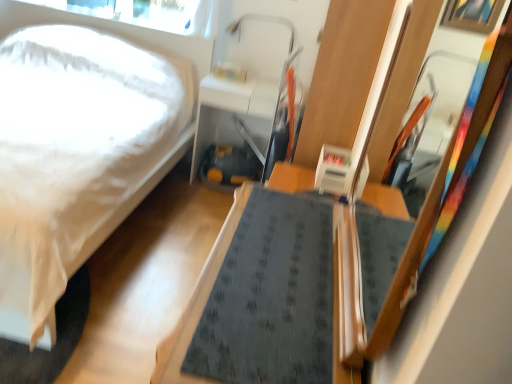
In order to face matte white table at center, the second table from the front, should I rotate leftwards or rightwards?

Turn left by 2.077 degrees to look at matte white table at center, the second table from the front.

Describe the element at coordinates (144, 13) in the screenshot. I see `transparent glass window screen at upper left` at that location.

The image size is (512, 384). What are the coordinates of `wooden framed mirror at right` in the screenshot? It's located at (390, 285).

In order to face wooden framed mirror at right, should I rotate leftwards or rightwards?

Rotate right and turn 17.343 degrees.

What do you see at coordinates (262, 298) in the screenshot? I see `dark gray fabric table at center, which appears as the 1th table when viewed from the front` at bounding box center [262, 298].

Locate an element on the screen. Image resolution: width=512 pixels, height=384 pixels. matte white table at center, the second table from the front is located at coordinates (232, 114).

Where is `mirror that is above the dark gray fabric table at center, which ranks as the second table in top-to-bottom order (from a real-world perspective)`? This screenshot has width=512, height=384. mirror that is above the dark gray fabric table at center, which ranks as the second table in top-to-bottom order (from a real-world perspective) is located at coordinates (390, 285).

Would you say dark gray fabric table at center, which appears as the 1th table when viewed from the front, is to the left or to the right of wooden framed mirror at right in the picture?

dark gray fabric table at center, which appears as the 1th table when viewed from the front, is to the left of wooden framed mirror at right.

From a real-world perspective, relative to wooden framed mirror at right, is dark gray fabric table at center, which ranks as the 1th table in bottom-to-top order, vertically above or below?

From a real-world perspective, dark gray fabric table at center, which ranks as the 1th table in bottom-to-top order, is physically below wooden framed mirror at right.

Is dark gray fabric table at center, which appears as the 1th table when viewed from the front, not close to wooden framed mirror at right?

Actually, dark gray fabric table at center, which appears as the 1th table when viewed from the front, and wooden framed mirror at right are a little close together.

What's the angular difference between matte white table at center, positioned as the first table in back-to-front order, and transparent glass window screen at upper left's facing directions?

matte white table at center, positioned as the first table in back-to-front order, and transparent glass window screen at upper left are facing 3.56 degrees away from each other.

Is matte white table at center, acting as the second table starting from the bottom, taller or shorter than transparent glass window screen at upper left?

Considering their sizes, matte white table at center, acting as the second table starting from the bottom, has more height than transparent glass window screen at upper left.

Is point (241, 98) positioned behind point (201, 16)?

That is False.

Is matte white table at center, acting as the second table starting from the bottom, placed right next to transparent glass window screen at upper left?

matte white table at center, acting as the second table starting from the bottom, is not next to transparent glass window screen at upper left, and they're not touching.

How many degrees apart are the facing directions of matte white table at center, positioned as the first table in back-to-front order, and dark gray fabric table at center, positioned as the second table in back-to-front order?

The facing directions of matte white table at center, positioned as the first table in back-to-front order, and dark gray fabric table at center, positioned as the second table in back-to-front order, are 91.6 degrees apart.

Is matte white table at center, marked as the first table in a top-to-bottom arrangement, not within dark gray fabric table at center, which ranks as the second table in top-to-bottom order?

That's correct, matte white table at center, marked as the first table in a top-to-bottom arrangement, is outside of dark gray fabric table at center, which ranks as the second table in top-to-bottom order.

Which of these two, matte white table at center, positioned as the first table in back-to-front order, or dark gray fabric table at center, which ranks as the second table in top-to-bottom order, stands taller?

With more height is matte white table at center, positioned as the first table in back-to-front order.

Does point (254, 137) appear closer or farther from the camera than point (224, 378)?

Point (254, 137) is positioned farther from the camera compared to point (224, 378).

Is transparent glass window screen at upper left touching dark gray fabric table at center, which appears as the 1th table when viewed from the front?

transparent glass window screen at upper left and dark gray fabric table at center, which appears as the 1th table when viewed from the front, are clearly separated.

How many degrees apart are the facing directions of transparent glass window screen at upper left and dark gray fabric table at center, which ranks as the 1th table in bottom-to-top order?

The angular difference between transparent glass window screen at upper left and dark gray fabric table at center, which ranks as the 1th table in bottom-to-top order, is 88 degrees.

Could you tell me if transparent glass window screen at upper left is facing dark gray fabric table at center, which ranks as the second table in top-to-bottom order?

No.

Locate an element on the screen. The image size is (512, 384). the 2nd table below when counting from the transparent glass window screen at upper left (from the image's perspective) is located at coordinates (262, 298).

Is white matte bed at left directly adjacent to transparent glass window screen at upper left?

No, white matte bed at left is not making contact with transparent glass window screen at upper left.

Which of these two, white matte bed at left or transparent glass window screen at upper left, is bigger?

white matte bed at left.

From the image's perspective, is white matte bed at left beneath transparent glass window screen at upper left?

Yes.

Considering the relative sizes of white matte bed at left and transparent glass window screen at upper left in the image provided, is white matte bed at left thinner than transparent glass window screen at upper left?

No.

Looking at this image, which of these two, matte white table at center, marked as the first table in a top-to-bottom arrangement, or white matte bed at left, is wider?

Wider between the two is white matte bed at left.

Does matte white table at center, acting as the second table starting from the bottom, lie in front of white matte bed at left?

That is False.

How different are the orientations of white matte bed at left and wooden framed mirror at right in degrees?

The angle between the facing direction of white matte bed at left and the facing direction of wooden framed mirror at right is 91.2 degrees.

Is wooden framed mirror at right at the back of white matte bed at left?

No.

Between white matte bed at left and wooden framed mirror at right, which one is positioned behind?

white matte bed at left is further away from the camera.

Would you say white matte bed at left is inside or outside wooden framed mirror at right?

white matte bed at left is outside wooden framed mirror at right.

Identify the location of mirror located on the right of dark gray fabric table at center, which ranks as the 1th table in bottom-to-top order. The height and width of the screenshot is (384, 512). (390, 285).

At what (x,y) coordinates should I click in order to perform the action: click on the 1st table positioned below the transparent glass window screen at upper left (from a real-world perspective). Please return your answer as a coordinate pair (x, y). Looking at the image, I should click on (232, 114).

Looking at the image, which one is located closer to wooden framed mirror at right, dark gray fabric table at center, positioned as the second table in back-to-front order, or transparent glass window screen at upper left?

Based on the image, dark gray fabric table at center, positioned as the second table in back-to-front order, appears to be nearer to wooden framed mirror at right.

Which object lies further to the anchor point matte white table at center, positioned as the first table in back-to-front order, wooden framed mirror at right or dark gray fabric table at center, which appears as the 1th table when viewed from the front?

The object further to matte white table at center, positioned as the first table in back-to-front order, is wooden framed mirror at right.

Estimate the real-world distances between objects in this image. Which object is further from matte white table at center, positioned as the first table in back-to-front order, wooden framed mirror at right or white matte bed at left?

Based on the image, wooden framed mirror at right appears to be further to matte white table at center, positioned as the first table in back-to-front order.

In the scene shown: Looking at the image, which one is located closer to matte white table at center, acting as the second table starting from the bottom, transparent glass window screen at upper left or white matte bed at left?

white matte bed at left is closer to matte white table at center, acting as the second table starting from the bottom.

Estimate the real-world distances between objects in this image. Which object is further from transparent glass window screen at upper left, white matte bed at left or wooden framed mirror at right?

The object further to transparent glass window screen at upper left is wooden framed mirror at right.

When comparing their distances from matte white table at center, the second table from the front, does dark gray fabric table at center, positioned as the second table in back-to-front order, or transparent glass window screen at upper left seem further?

dark gray fabric table at center, positioned as the second table in back-to-front order, is positioned further to the anchor matte white table at center, the second table from the front.

Estimate the real-world distances between objects in this image. Which object is further from white matte bed at left, wooden framed mirror at right or matte white table at center, the second table from the front?

Based on the image, wooden framed mirror at right appears to be further to white matte bed at left.

Which object lies further to the anchor point transparent glass window screen at upper left, matte white table at center, the second table from the front, or wooden framed mirror at right?

Based on the image, wooden framed mirror at right appears to be further to transparent glass window screen at upper left.

Where is `table positioned between wooden framed mirror at right and matte white table at center, the second table from the front, from near to far`? table positioned between wooden framed mirror at right and matte white table at center, the second table from the front, from near to far is located at coordinates (262, 298).

In order to click on bed located between wooden framed mirror at right and transparent glass window screen at upper left in the depth direction in this screenshot , I will do `click(73, 150)`.

The width and height of the screenshot is (512, 384). I want to click on bed positioned between dark gray fabric table at center, positioned as the second table in back-to-front order, and transparent glass window screen at upper left from near to far, so pyautogui.click(x=73, y=150).

The image size is (512, 384). I want to click on bed between dark gray fabric table at center, which appears as the 1th table when viewed from the front, and matte white table at center, the second table from the front, in the front-back direction, so click(73, 150).